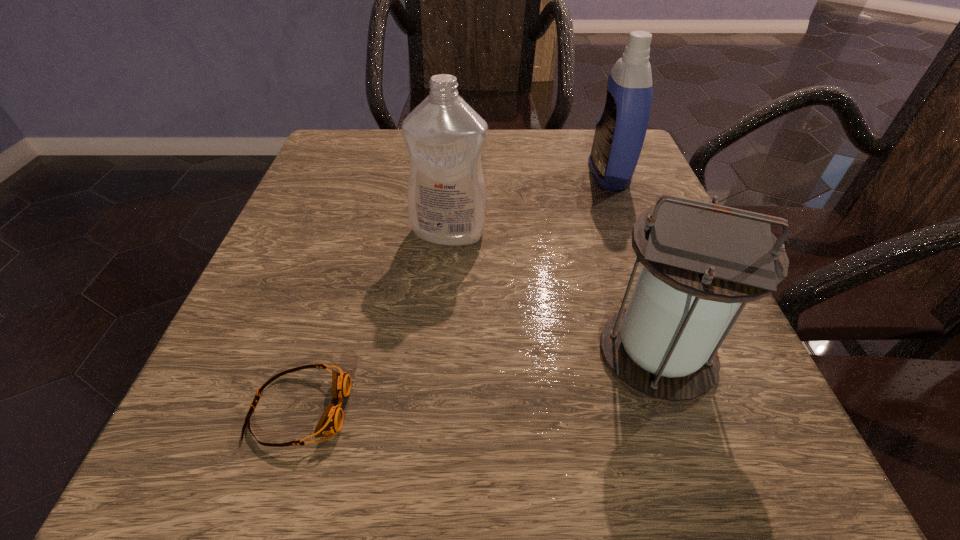
This screenshot has height=540, width=960. I want to click on the farthest object, so click(620, 131).

You are a GUI agent. You are given a task and a screenshot of the screen. Output one action in this format:
    pyautogui.click(x=<x>, y=<y>)
    Task: Click on the right detergent
    
    Given the screenshot: What is the action you would take?
    pyautogui.click(x=620, y=131)

Identify the location of the left detergent. (447, 201).

You are a GUI agent. You are given a task and a screenshot of the screen. Output one action in this format:
    pyautogui.click(x=<x>, y=<y>)
    Task: Click on the second object from left to right
    
    Given the screenshot: What is the action you would take?
    pyautogui.click(x=447, y=201)

Image resolution: width=960 pixels, height=540 pixels. Identify the location of lantern. (700, 260).

What are the coordinates of `the leftmost object` in the screenshot? It's located at click(x=331, y=421).

Find the location of a particular element. The image size is (960, 540). the shortest object is located at coordinates (331, 421).

Identify the location of vacant space located 0.260m on the left of the farther detergent. (466, 174).

The height and width of the screenshot is (540, 960). Identify the location of vacant area situated 0.070m on the back of the nearer detergent. (452, 195).

Identify the location of vacant point located on the back of the lantern. Image resolution: width=960 pixels, height=540 pixels. (594, 170).